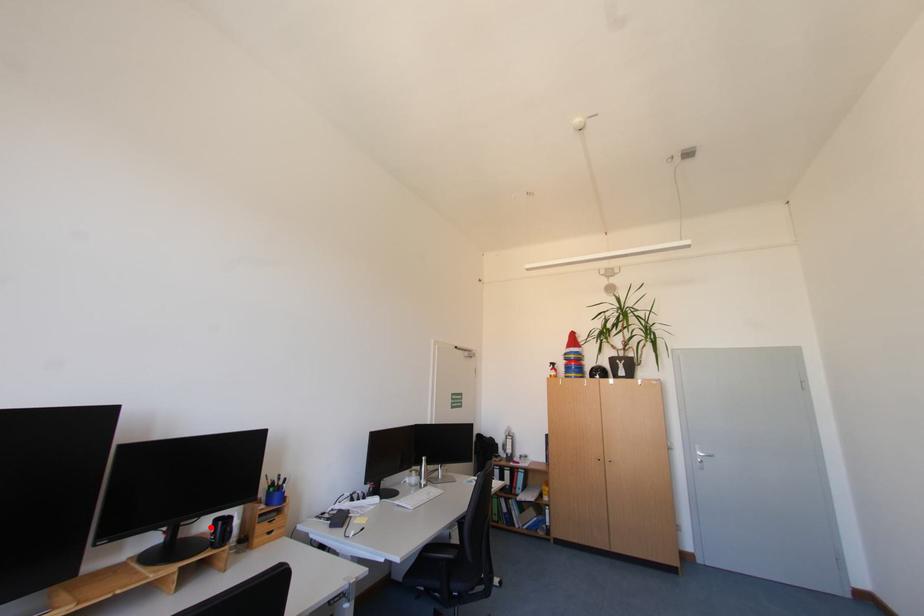
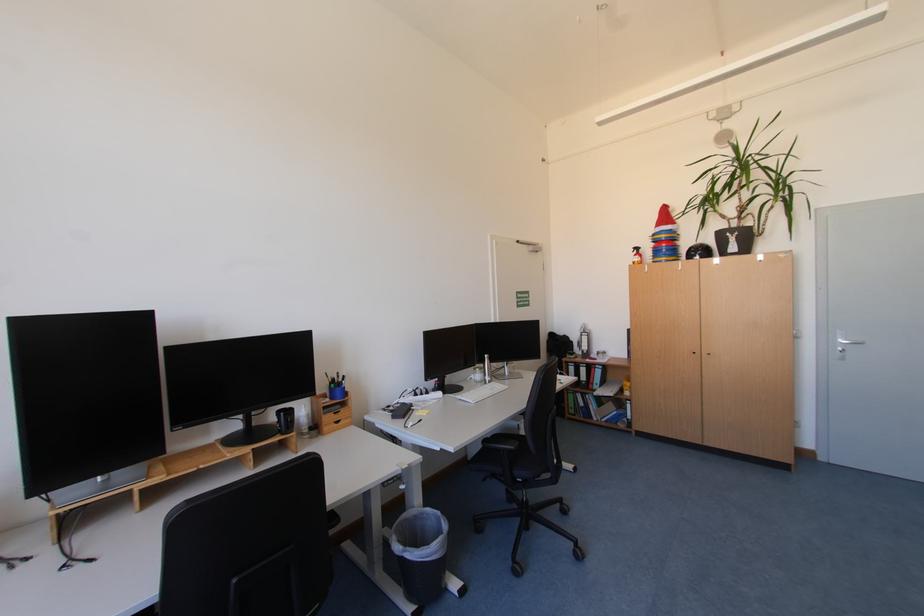
The point at the highlighted location is marked in the first image. Where is the corresponding point in the second image?

(277, 416)